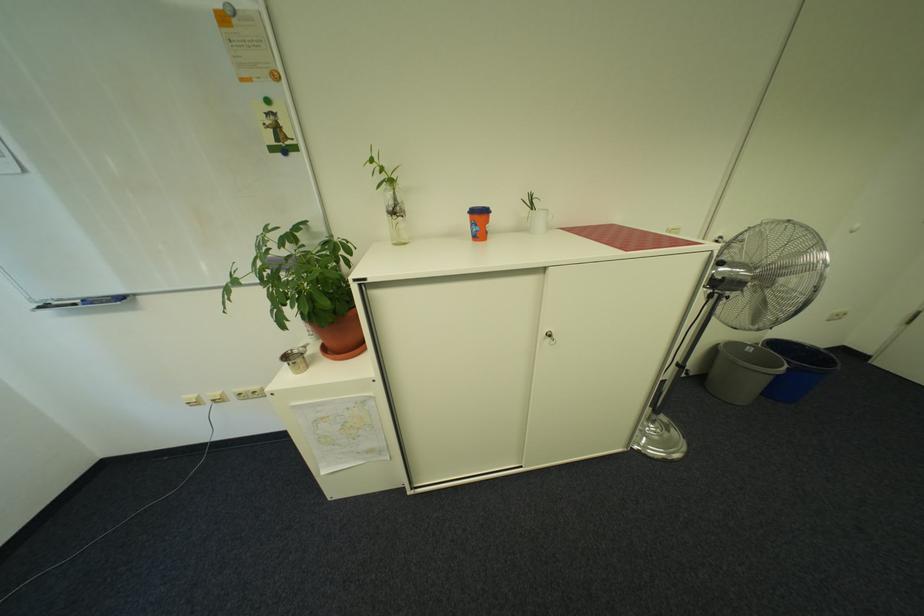
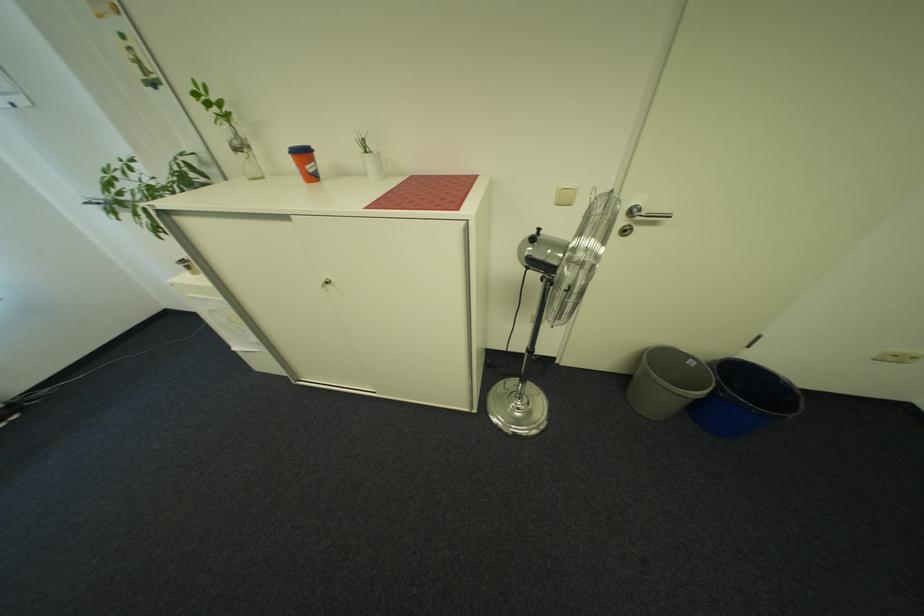
Find the pixel in the second image that matches point (789, 378) in the first image.

(707, 403)